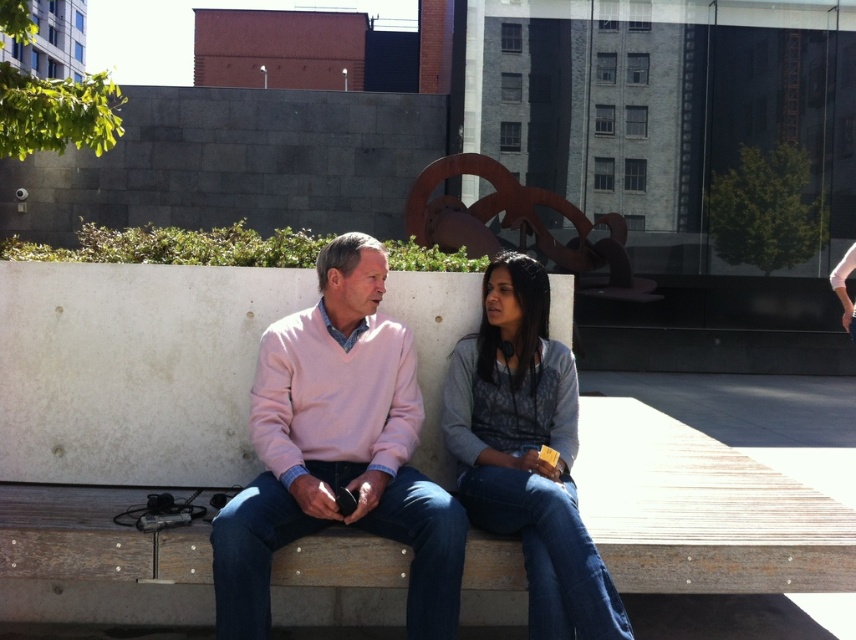
You are a photographer standing 2 meters away from the pink sweater at center. You want to take a photo of the camera being held by the man. Can you capture the camera in the frame without moving closer?

The pink sweater at center and camera are 3.03 meters apart. Since you are 2 meters away from the pink sweater at center, the camera is 3.03 meters away from the sweater, meaning the camera is 5.03 meters away from you. Therefore, you cannot capture the camera in the frame without moving closer.

You are standing in front of the bench where the two people are sitting. You want to hand a brochure to the person wearing the pink sweater at center without disturbing the person in the denim jacket at center. Which direction should you approach from?

The pink sweater at center is closer to you than the denim jacket at center. Approach from the side of the pink sweater at center to avoid disturbing the person in the denim jacket at center.

You are an architect designing a new public space and want to place a bench where the pink sweater at center is located. The coordinates given are in a normalized system where the bottom left corner is 0,0 and the top right is 1,1. If the actual bench is 1.5 meters wide, what are the coordinates of its left and right edges?

The pink sweater at center is located at coordinates (337, 451). Since the bench is 1.5 meters wide and centered at this point, the left edge would be at 0.705 minus half of 1.5 meters, and the right edge at 0.705 plus half of 1.5 meters. However, without knowing the total width of the image in meters, we cannot convert the normalized coordinates to actual positions. Therefore, the coordinates remain at (337, 451) with the bench spanning 1.5 meters around this point.